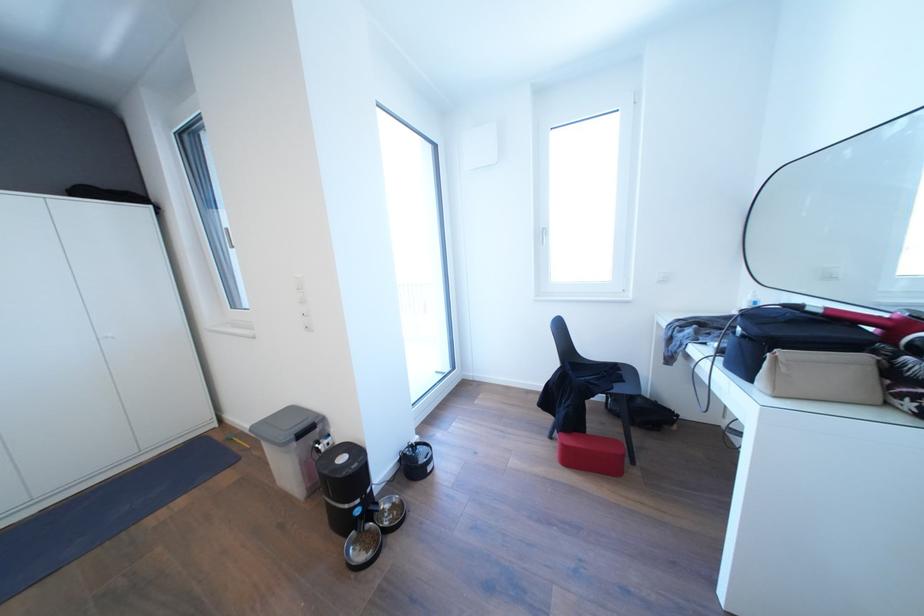
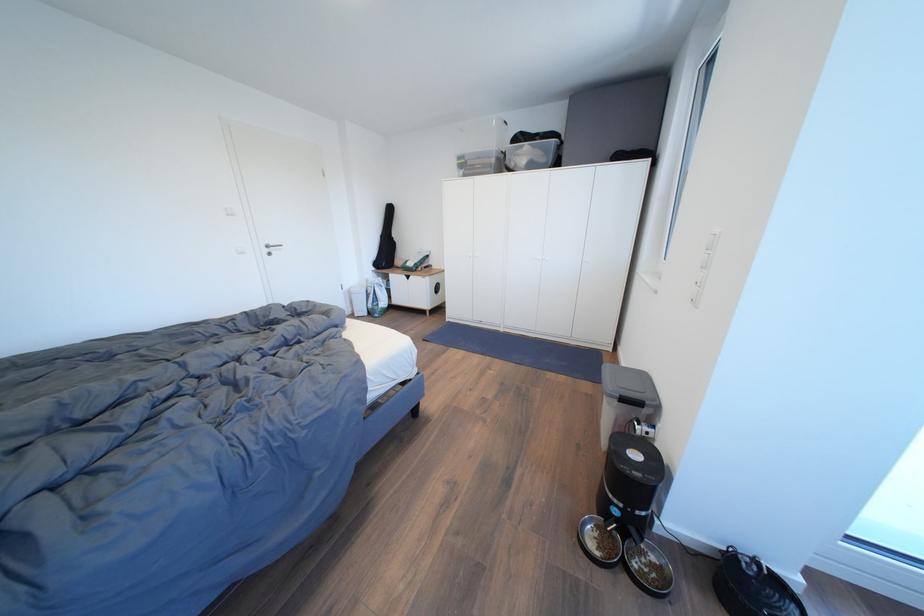
The point at (366,553) is marked in the first image. Where is the corresponding point in the second image?

(603, 540)